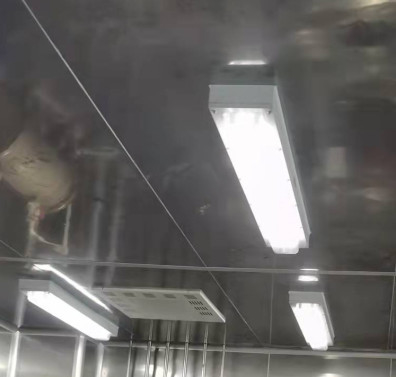
This screenshot has width=396, height=377. Find the location of `canister`. canister is located at coordinates (50, 182).